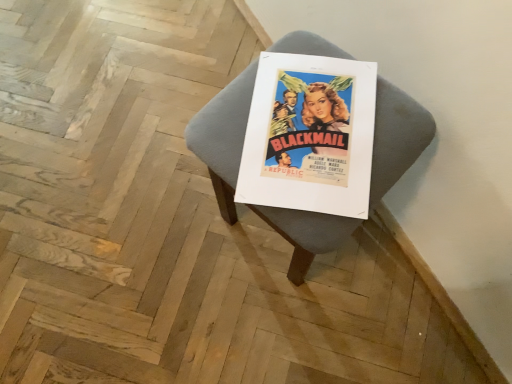
At what (x,y) coordinates should I click in order to perform the action: click on vacant space situated above matte paper poster at center (from a real-world perspective). Please return your answer as a coordinate pair (x, y). This screenshot has height=384, width=512. Looking at the image, I should click on (309, 126).